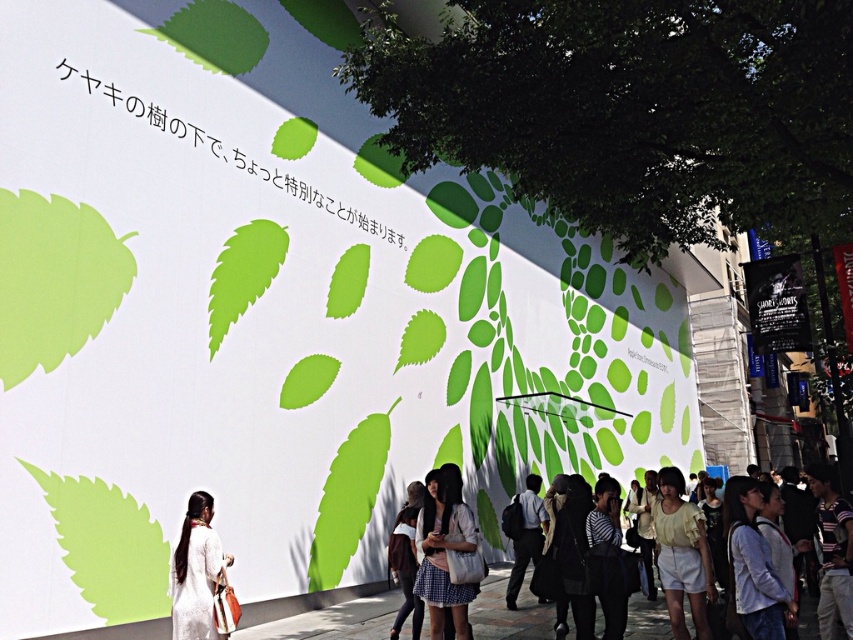
Question: Which point appears farthest from the camera in this image?

Choices:
 (A) (207, 584)
 (B) (784, 627)
 (C) (289, 625)

Answer: (C)

Question: Does silky white dress at lower left have a smaller size compared to dark gray wool coat at center?

Choices:
 (A) no
 (B) yes

Answer: (B)

Question: Where is light blue denim jacket at lower right located in relation to matte white dress at lower center in the image?

Choices:
 (A) right
 (B) left

Answer: (A)

Question: Which of the following is the farthest from the observer?

Choices:
 (A) (405, 593)
 (B) (473, 534)
 (C) (575, 532)

Answer: (A)

Question: Is silky white dress at lower left positioned before matte white dress at lower center?

Choices:
 (A) no
 (B) yes

Answer: (B)

Question: Which object is farther from the camera taking this photo?

Choices:
 (A) dark gray wool coat at center
 (B) concrete pavement at lower center
 (C) silky white dress at lower left

Answer: (B)